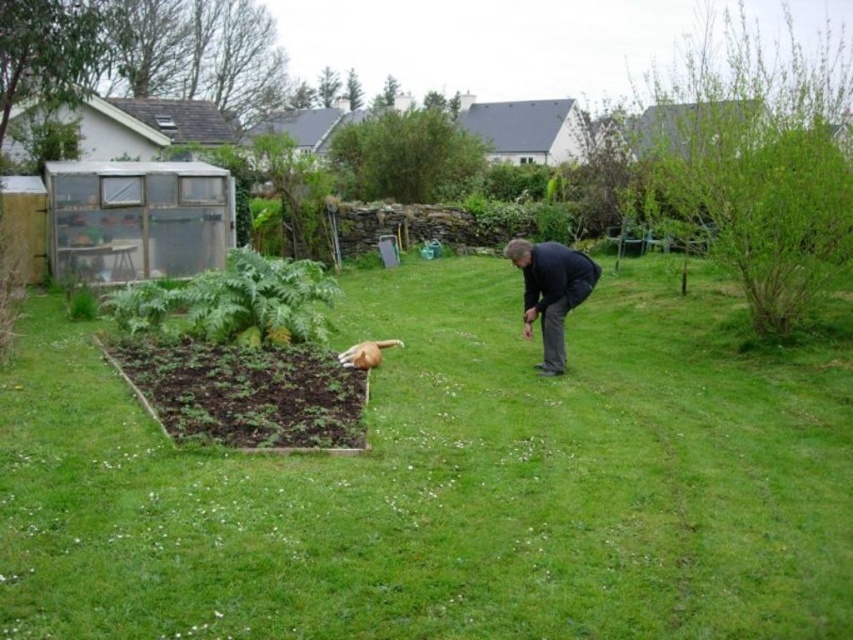
Question: Is green grass at center bigger than dark blue jacket at center?

Choices:
 (A) yes
 (B) no

Answer: (A)

Question: Does green grass at center lie behind dark blue jacket at center?

Choices:
 (A) no
 (B) yes

Answer: (A)

Question: Which point is closer to the camera?

Choices:
 (A) green grass at center
 (B) dark blue jacket at center
 (C) brown fur dog at lower center

Answer: (A)

Question: Considering the real-world distances, which object is farthest from the dark blue jacket at center?

Choices:
 (A) brown fur dog at lower center
 (B) green grass at center

Answer: (B)

Question: Does green grass at center appear on the left side of brown fur dog at lower center?

Choices:
 (A) yes
 (B) no

Answer: (B)

Question: Which object appears closest to the camera in this image?

Choices:
 (A) green grass at center
 (B) dark blue jacket at center
 (C) brown fur dog at lower center

Answer: (A)